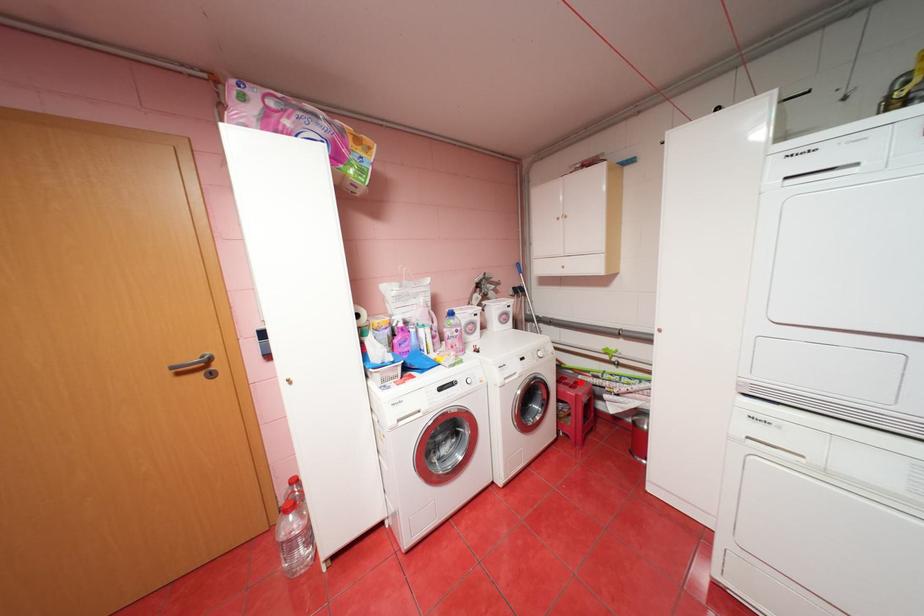
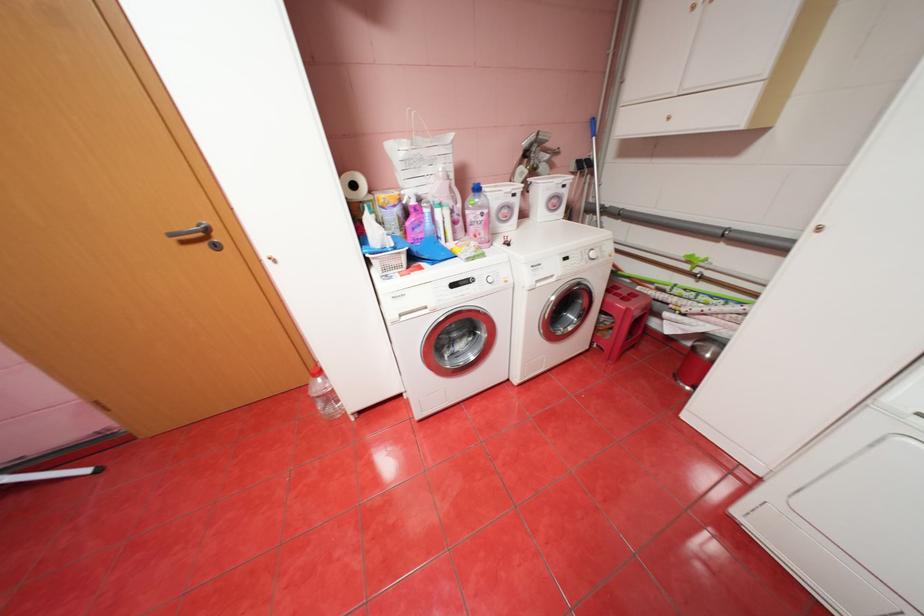
Question: A red point is marked in image1. In image2, is the corresponding 3D point closer to the camera or farther? Reply with the corresponding letter.

Choices:
 (A) The corresponding 3D point is closer.
 (B) The corresponding 3D point is farther.

Answer: (A)